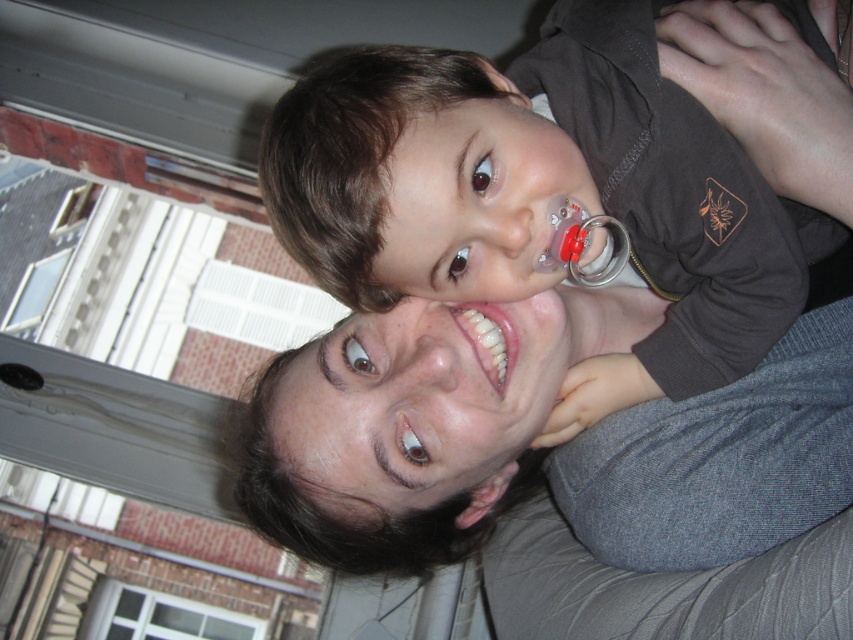
You are a photographer standing in front of the smooth gray sweater at center. You want to take a clear photo of it. What is the recommended minimum distance you should maintain to ensure the sweater is in focus?

The smooth gray sweater at center and viewer are 28.92 inches apart, so the recommended minimum distance to maintain is 28.92 inches to ensure the sweater is in focus.

You are a photographer trying to capture the scene where the child is leaning on the adult. You need to place a sticker at point [541,195]. What object will the sticker be placed on?

The sticker will be placed on the matte brown shirt at upper center because the point [541,195] is on matte brown shirt at upper center.

You are a photographer trying to capture the affectionate moment between the two people in the image. You want to ensure the matte brown shirt at upper center and the smooth gray sweater at center are both visible in the photo. Based on their positions, which one should you focus on first to ensure both are in frame?

The matte brown shirt at upper center is located above the smooth gray sweater at center, so focusing on the matte brown shirt at upper center first will ensure both are in frame as the gray sweater is below it.